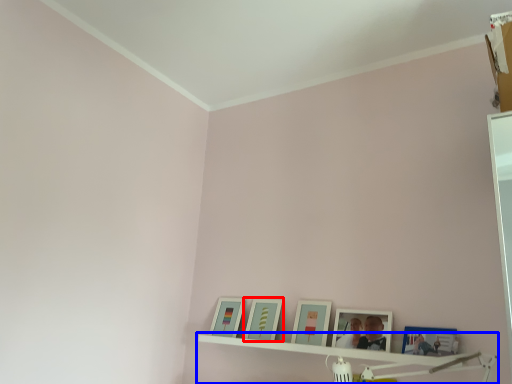
Question: Among these objects, which one is nearest to the camera, picture frame (highlighted by a red box) or shelf (highlighted by a blue box)?

Choices:
 (A) picture frame
 (B) shelf

Answer: (B)